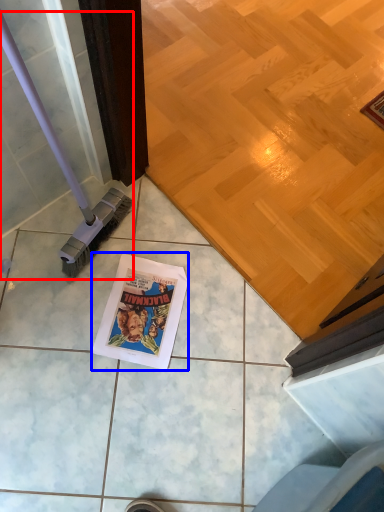
Question: Among these objects, which one is nearest to the camera, brush (highlighted by a red box) or comic book (highlighted by a blue box)?

Choices:
 (A) brush
 (B) comic book

Answer: (A)